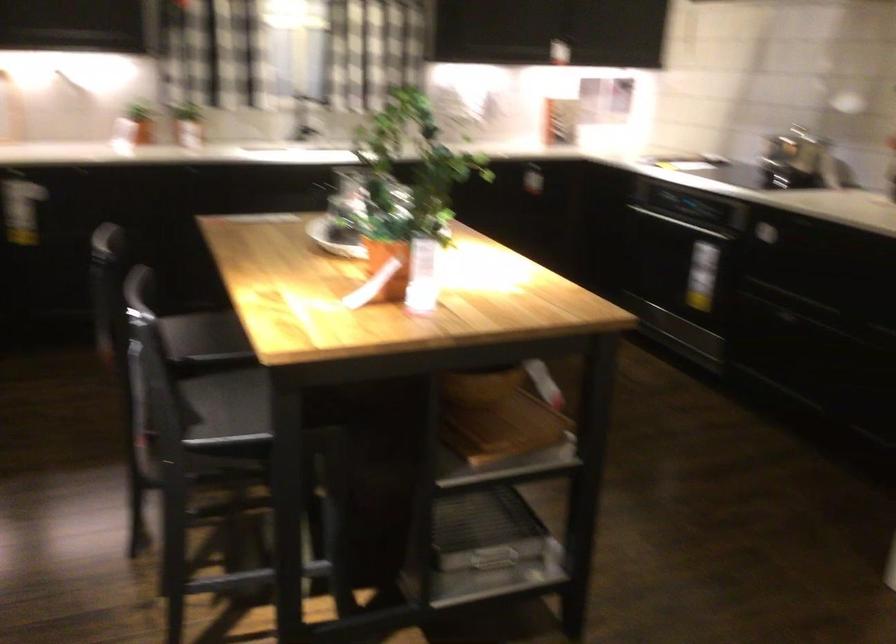
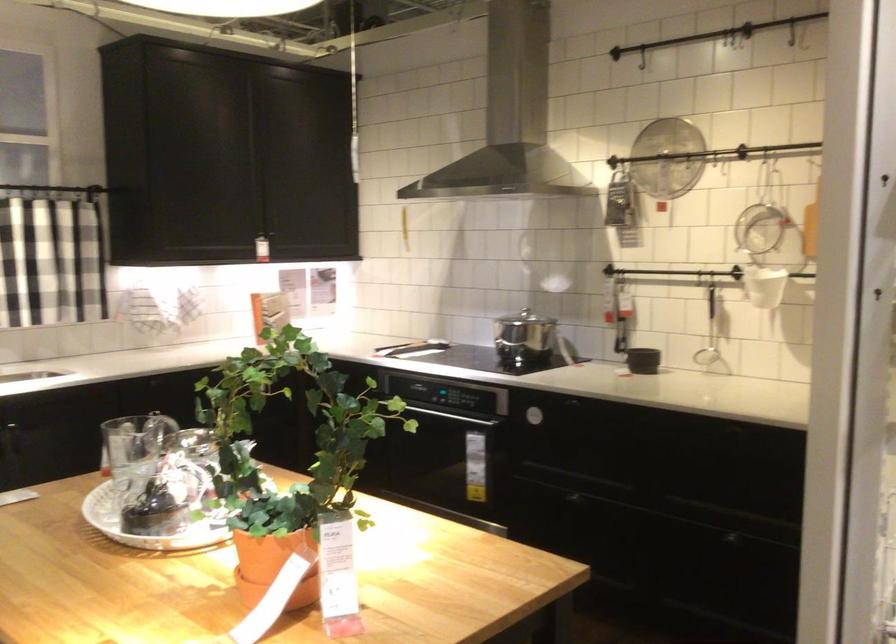
Question: Based on the continuous images, in which direction is the camera rotating? Reply with the corresponding letter.

Choices:
 (A) Left
 (B) Right
 (C) Up
 (D) Down

Answer: (B)